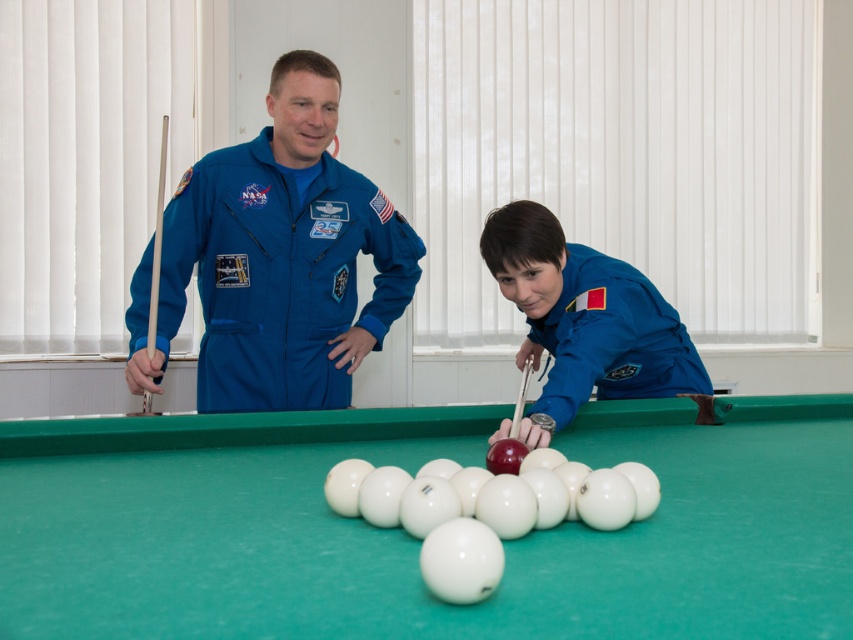
Based on the photo, you are an astronaut in the same room and need to move from your current position to the pool table. Which direction should you move relative to the blue fabric astronaut at center?

The blue fabric astronaut at center is located at point (584,320), so you should move towards the pool table in the direction opposite to the astronaut.

You are an astronaut in a training facility. You need to locate the green felt billiard table at center for a team exercise. Using the coordinate system where the bottom left corner is the origin, can you confirm the table is positioned at point 0.845, 0.491?

The green felt billiard table at center is indeed located at point [418,540] according to the coordinate system provided.

You are an astronaut in a training facility and need to grab the matte wood cue at center. The blue fabric astronaut at center is blocking your path. Can you reach the cue without moving the astronaut?

The blue fabric astronaut at center is 11.80 inches away from the matte wood cue at center. Since the distance is relatively small, you can likely reach the cue without moving the astronaut by extending your arm or leaning around them.